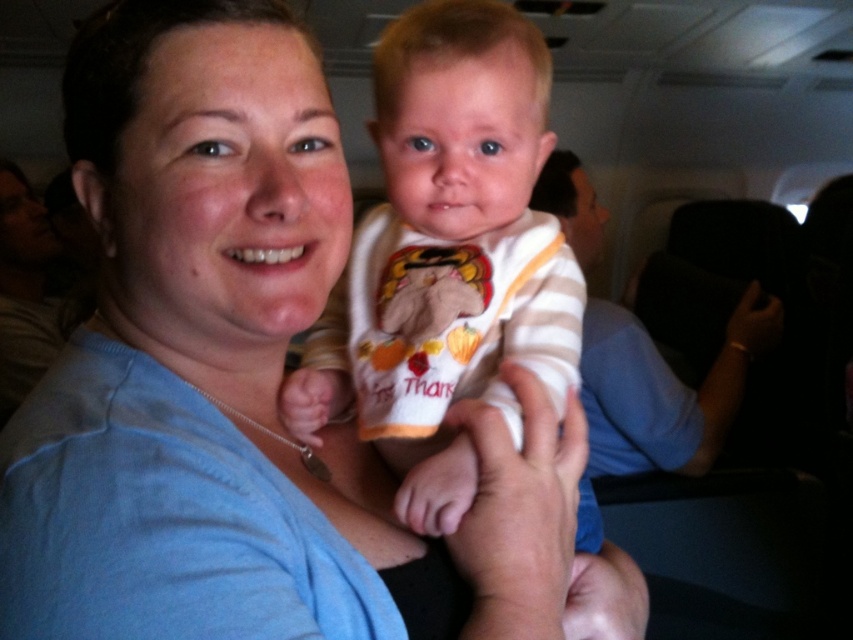
Question: Is blue cotton shirt at center closer to the viewer compared to white striped onesie at center?

Choices:
 (A) no
 (B) yes

Answer: (B)

Question: Which is farther from the white striped onesie at center?

Choices:
 (A) blue cotton shirt at center
 (B) striped fabric baby at center

Answer: (B)

Question: Is blue cotton shirt at center below white striped onesie at center?

Choices:
 (A) yes
 (B) no

Answer: (A)

Question: Which point is farther to the camera?

Choices:
 (A) (595, 467)
 (B) (190, 260)

Answer: (A)

Question: Which of the following is the farthest from the observer?

Choices:
 (A) striped fabric baby at center
 (B) blue cotton shirt at center

Answer: (A)

Question: Can you confirm if blue cotton shirt at center is wider than striped fabric baby at center?

Choices:
 (A) no
 (B) yes

Answer: (A)